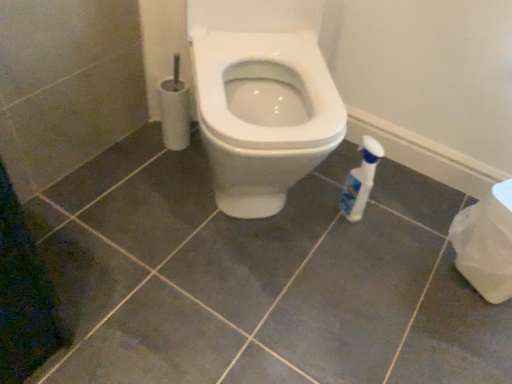
The width and height of the screenshot is (512, 384). Find the location of `vacant area that is in front of white plastic spray bottle at lower right`. vacant area that is in front of white plastic spray bottle at lower right is located at coordinates (354, 256).